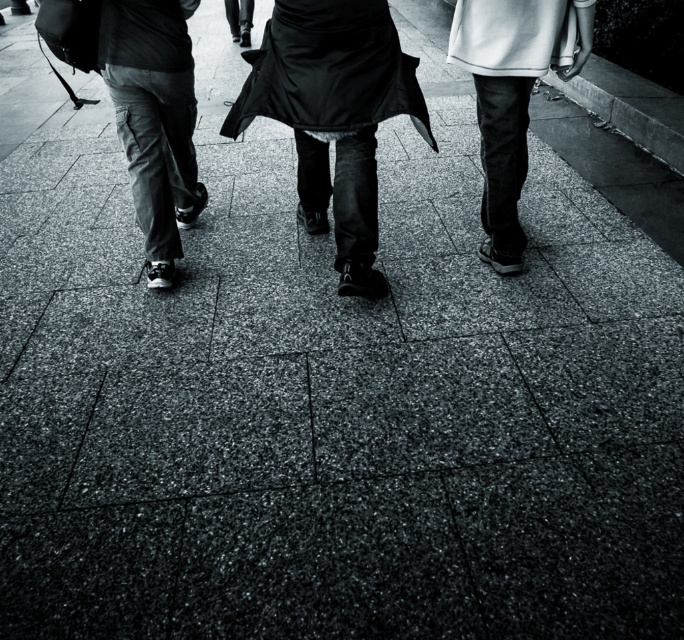
Question: Is matte black skirt at center in front of dark gray cargo pants at left?

Choices:
 (A) no
 (B) yes

Answer: (B)

Question: Which object is closer to the camera taking this photo?

Choices:
 (A) matte black skirt at center
 (B) smooth black pants at right
 (C) dark gray cargo pants at left

Answer: (A)

Question: Is matte black skirt at center smaller than dark gray cargo pants at left?

Choices:
 (A) yes
 (B) no

Answer: (B)

Question: Is matte black skirt at center bigger than dark gray cargo pants at left?

Choices:
 (A) no
 (B) yes

Answer: (B)

Question: Which point is closer to the camera?

Choices:
 (A) dark gray cargo pants at left
 (B) smooth black pants at right
 (C) matte black skirt at center

Answer: (C)

Question: Estimate the real-world distances between objects in this image. Which object is closer to the smooth black pants at right?

Choices:
 (A) dark gray cargo pants at left
 (B) matte black skirt at center

Answer: (B)